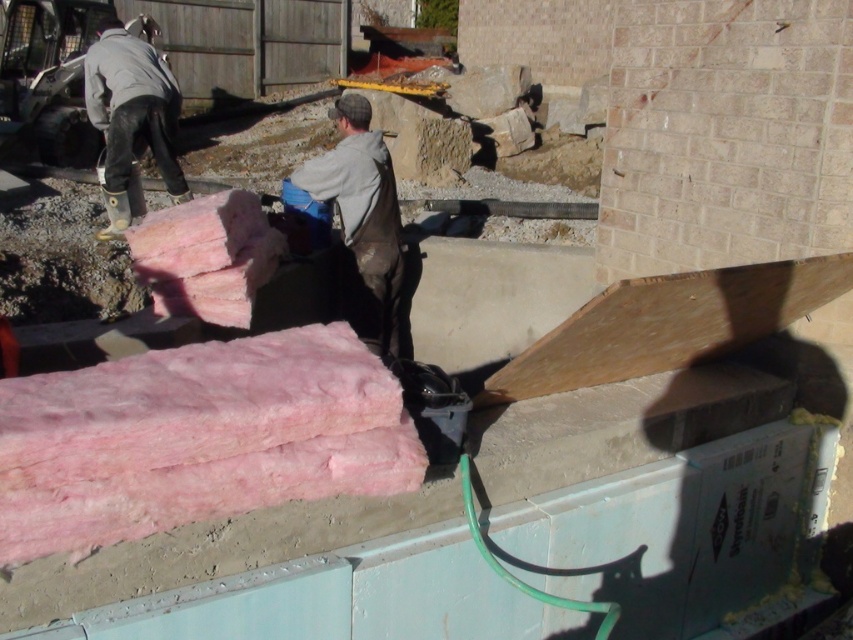
You are a construction worker on the site. You need to move the pink fiberglass insulation at lower left to a higher position. Which object from the scene can you use as a reference point to ensure it is placed above the gray matte jacket at upper left?

The gray matte jacket at upper left is located above the pink fiberglass insulation at lower left. To place the insulation above the jacket, you need to position it higher than its current location, ensuring it is above the jacket.

You are a construction worker who needs to locate your gray matte jacket at center. Where is it located in the image?

The gray matte jacket at center is located at point (363, 218) in the image.

You are a worker at the construction site and need to determine which of the two points, point (395, 246) or point (119, 40), is closer to your current position. Based on the image provided, which point is nearer to you?

Point (395, 246) is closer to the camera than point (119, 40), so it is nearer to your current position.